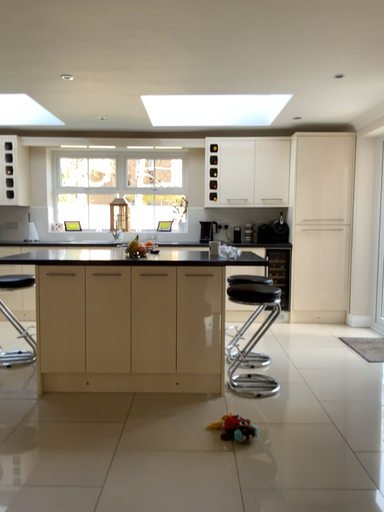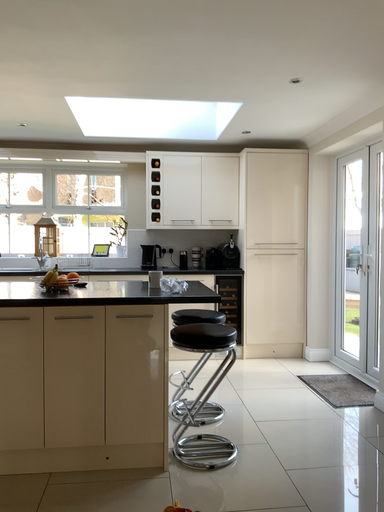
Question: How did the camera likely rotate when shooting the video?

Choices:
 (A) rotated left
 (B) rotated right

Answer: (B)